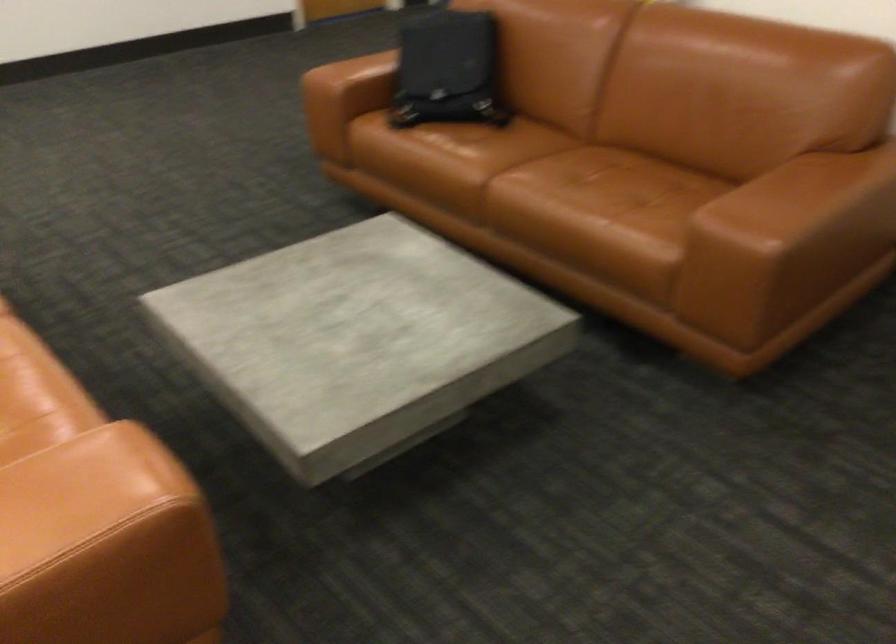
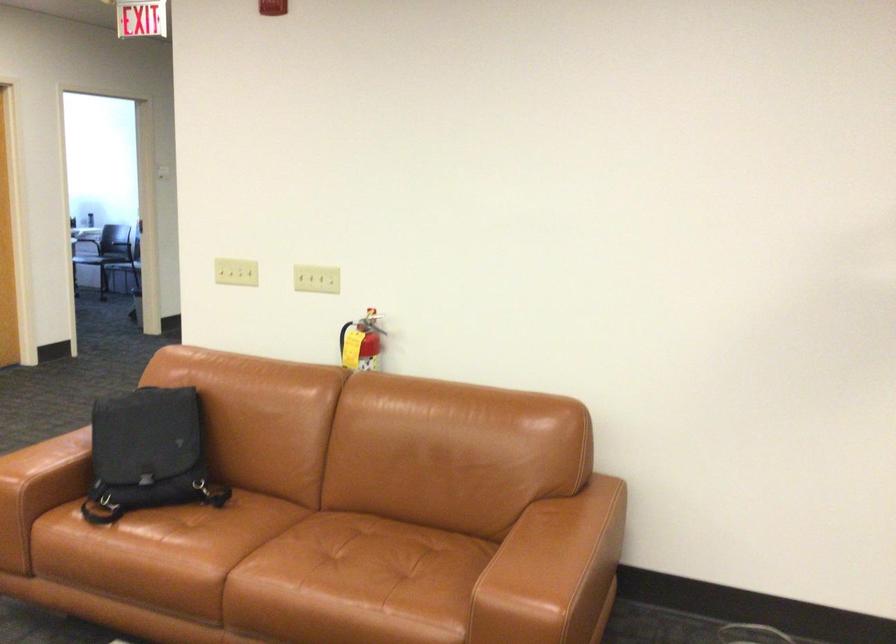
Locate, in the second image, the point that corresponds to the point at 588,189 in the first image.

(350, 574)